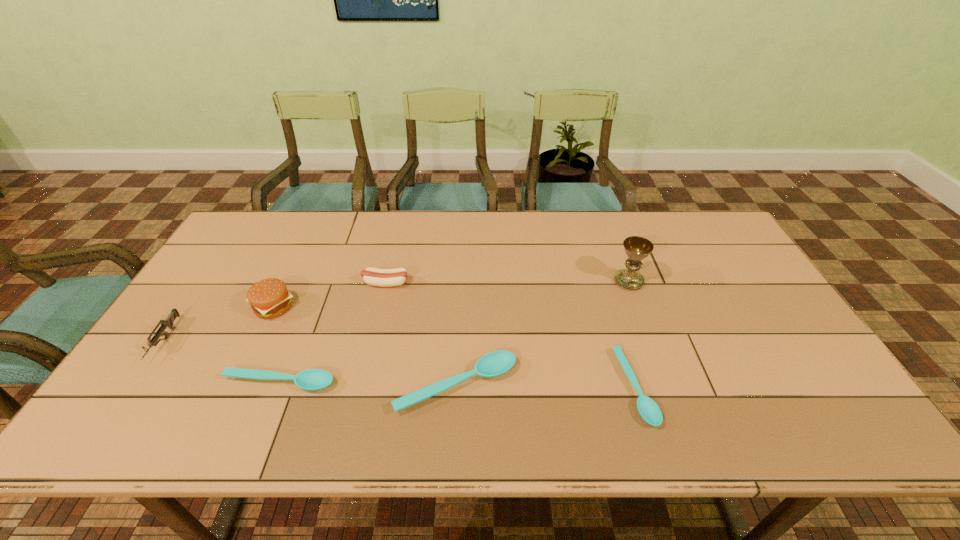
Locate an element on the screen. This screenshot has height=540, width=960. free region located 0.340m on the back of the sixth tallest object is located at coordinates (321, 280).

The height and width of the screenshot is (540, 960). I want to click on free space located 0.270m on the left of the third object from right to left, so click(x=283, y=386).

Where is `vacant region located 0.220m on the right of the shortest object`? vacant region located 0.220m on the right of the shortest object is located at coordinates (741, 387).

This screenshot has height=540, width=960. I want to click on vacant space located on the front of the sausage, so click(376, 323).

Locate an element on the screen. vacant position located 0.260m on the back of the rightmost object is located at coordinates (607, 223).

In order to click on free space located 0.070m aimed along the barrel of the leftmost object in this screenshot , I will do `click(131, 391)`.

Identify the location of vacant space located 0.050m on the back of the hamburger. (286, 280).

At what (x,y) coordinates should I click in order to perform the action: click on object present at the left edge. Please return your answer as a coordinate pair (x, y). Looking at the image, I should click on (168, 322).

Where is `vacant region at the far edge of the desktop`? The width and height of the screenshot is (960, 540). vacant region at the far edge of the desktop is located at coordinates (347, 228).

Where is `free space at the near edge of the desktop`? The image size is (960, 540). free space at the near edge of the desktop is located at coordinates (414, 380).